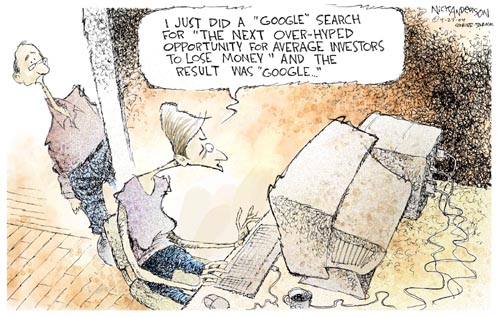
Where is `cords behind computer`? This screenshot has height=317, width=500. cords behind computer is located at coordinates (439, 178), (450, 155), (436, 190).